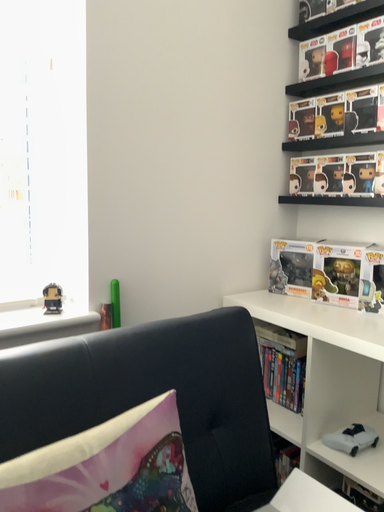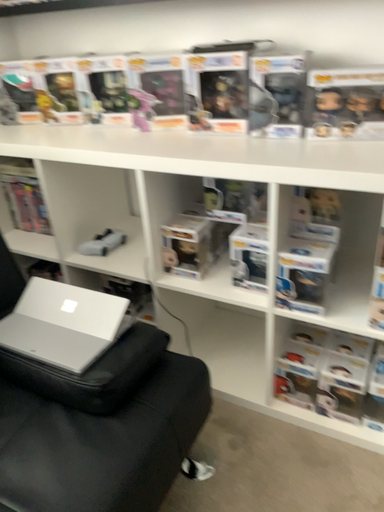
Question: Which way did the camera rotate in the video?

Choices:
 (A) rotated left
 (B) rotated right

Answer: (B)